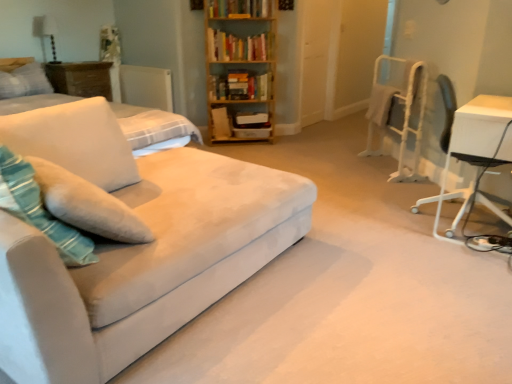
Question: Is teal velvety throw pillow at left to the left of white soft pillow at upper left, positioned as the second pillow in bottom-to-top order, from the viewer's perspective?

Choices:
 (A) yes
 (B) no

Answer: (B)

Question: From the image's perspective, would you say teal velvety throw pillow at left is positioned over white soft pillow at upper left, which is the second pillow in front-to-back order?

Choices:
 (A) yes
 (B) no

Answer: (B)

Question: Does teal velvety throw pillow at left have a greater height compared to white soft pillow at upper left, the first pillow in the top-to-bottom sequence?

Choices:
 (A) no
 (B) yes

Answer: (B)

Question: Is teal velvety throw pillow at left positioned in front of white soft pillow at upper left, the second pillow from the right?

Choices:
 (A) yes
 (B) no

Answer: (A)

Question: Is teal velvety throw pillow at left not near white soft pillow at upper left, positioned as the second pillow in bottom-to-top order?

Choices:
 (A) no
 (B) yes

Answer: (B)

Question: Is soft white fabric pillow at left, the 2th pillow viewed from the top, bigger or smaller than hardcover book at upper center, which appears as the first book when viewed from the top?

Choices:
 (A) big
 (B) small

Answer: (A)

Question: From the image's perspective, is soft white fabric pillow at left, the 1th pillow in the front-to-back sequence, positioned above or below hardcover book at upper center, which is the third book from bottom to top?

Choices:
 (A) below
 (B) above

Answer: (A)

Question: From their relative heights in the image, would you say soft white fabric pillow at left, the 2th pillow viewed from the top, is taller or shorter than hardcover book at upper center, which appears as the first book when viewed from the top?

Choices:
 (A) short
 (B) tall

Answer: (B)

Question: From a real-world perspective, is soft white fabric pillow at left, the 1th pillow in the front-to-back sequence, above or below hardcover book at upper center, which is the third book from bottom to top?

Choices:
 (A) below
 (B) above

Answer: (A)

Question: Choose the correct answer: Is wooden bookcase at upper center inside wooden table at left, the second table in the right-to-left sequence, or outside it?

Choices:
 (A) inside
 (B) outside

Answer: (B)

Question: Relative to wooden table at left, the second table in the right-to-left sequence, is wooden bookcase at upper center in front or behind?

Choices:
 (A) front
 (B) behind

Answer: (A)

Question: In terms of height, does wooden bookcase at upper center look taller or shorter compared to wooden table at left, the second table positioned from the front?

Choices:
 (A) tall
 (B) short

Answer: (A)

Question: Is wooden bookcase at upper center bigger or smaller than wooden table at left, arranged as the first table when viewed from the left?

Choices:
 (A) small
 (B) big

Answer: (B)

Question: From the image's perspective, is white matte radiator at upper left located above or below suede couch at left?

Choices:
 (A) above
 (B) below

Answer: (A)

Question: Is point (136, 77) closer or farther from the camera than point (307, 210)?

Choices:
 (A) closer
 (B) farther

Answer: (B)